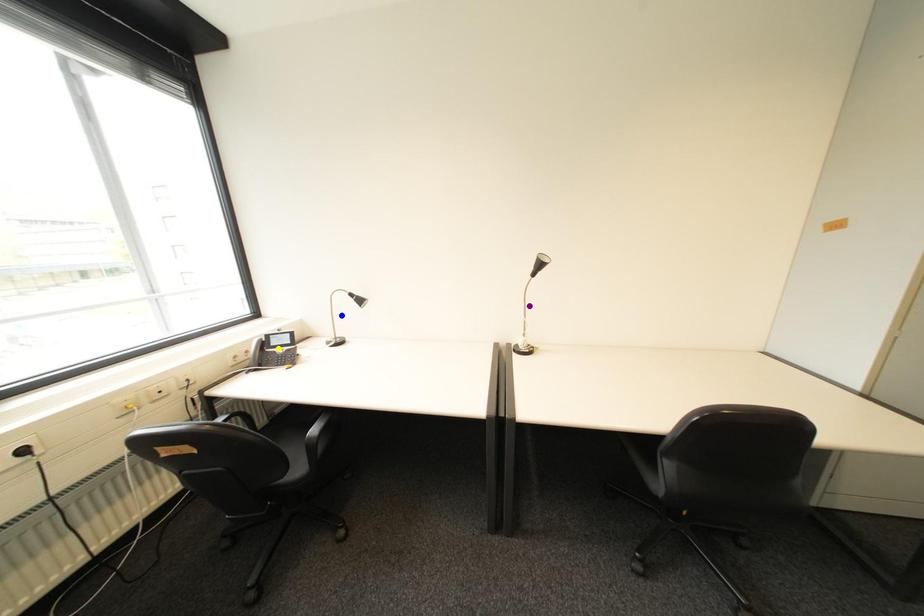
Order these from nearest to farthest:
purple point
blue point
yellow point

yellow point
purple point
blue point